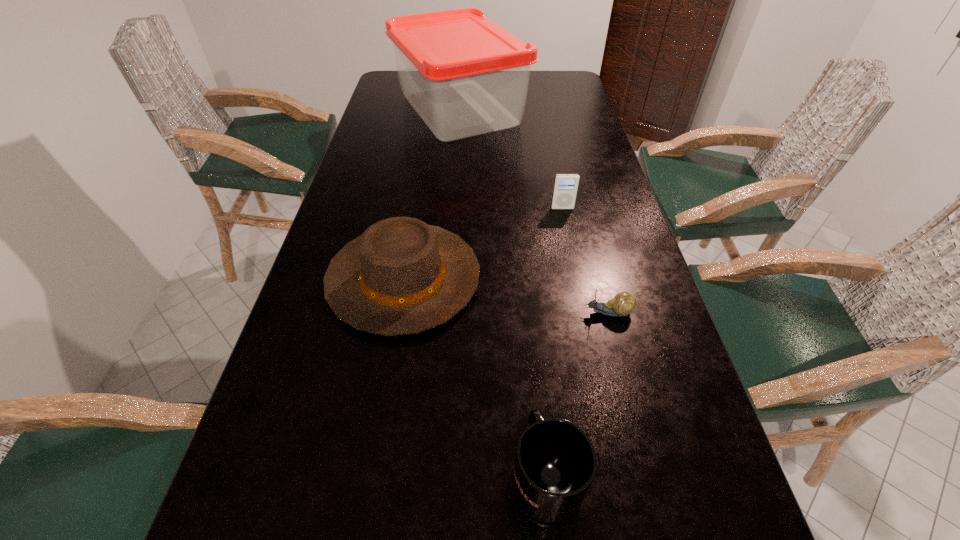
Locate an element on the screen. tray is located at coordinates (464, 75).

Image resolution: width=960 pixels, height=540 pixels. Find the location of `the tallest object`. the tallest object is located at coordinates (464, 75).

Where is `cowboy hat`? The image size is (960, 540). cowboy hat is located at coordinates (402, 276).

This screenshot has height=540, width=960. What are the coordinates of `the nearest object` in the screenshot? It's located at (555, 463).

Where is `the fourth nearest object`? the fourth nearest object is located at coordinates (566, 185).

You are a GUI agent. You are given a task and a screenshot of the screen. Output one action in this format:
    pyautogui.click(x=<x>, y=<y>)
    Task: Click on the shortest object
    The height and width of the screenshot is (540, 960).
    Given the screenshot: What is the action you would take?
    [x=623, y=303]

Where is `free space located 0.270m on the front of the tray`? The width and height of the screenshot is (960, 540). free space located 0.270m on the front of the tray is located at coordinates (452, 202).

Where is `blank space located on the right of the cowboy hat`? blank space located on the right of the cowboy hat is located at coordinates (520, 279).

Locate an element on the screen. The image size is (960, 540). free location located with the handle on the side of the mug is located at coordinates point(535,360).

Locate an element on the screen. This screenshot has width=960, height=540. vacant area situated 0.060m with the handle on the side of the mug is located at coordinates (539, 399).